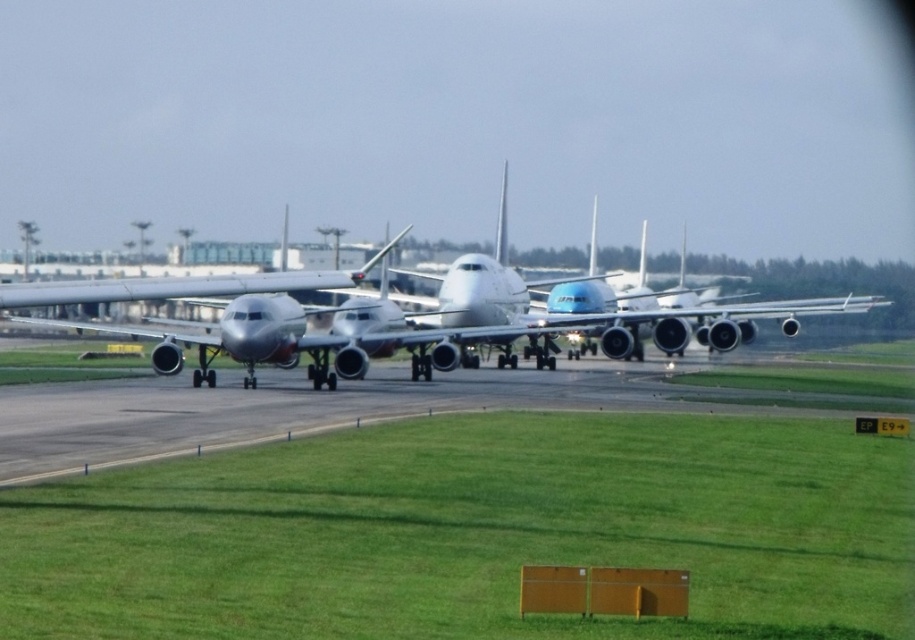
Can you confirm if green grass at lower center is thinner than metallic silver airplane at center?

Yes, green grass at lower center is thinner than metallic silver airplane at center.

In the scene shown: Can you confirm if green grass at lower center is taller than metallic silver airplane at center?

No.

Is point (163, 506) positioned behind point (85, 326)?

No, it is not.

Where is `green grass at lower center`? The image size is (915, 640). green grass at lower center is located at coordinates (472, 532).